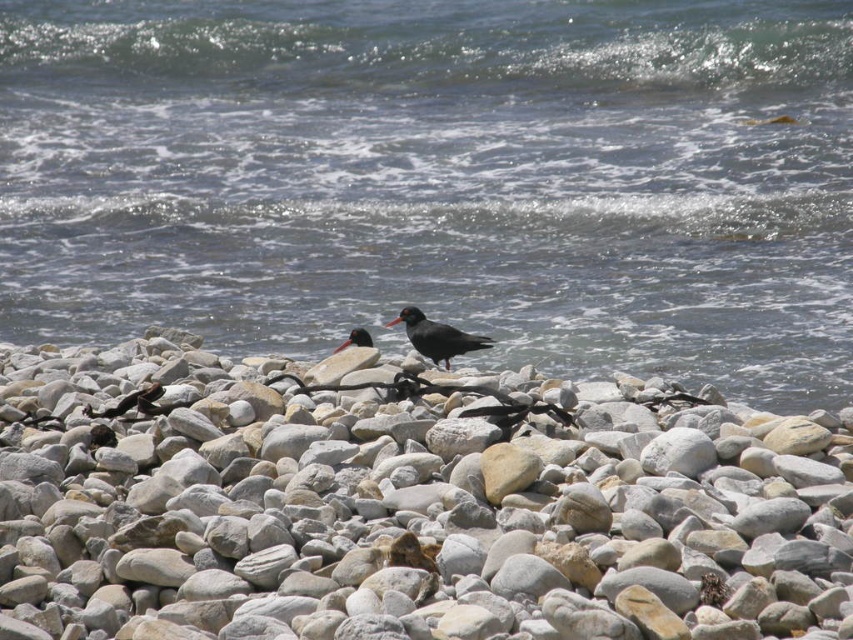
Question: Which object is closer to the camera taking this photo?

Choices:
 (A) black matte bird at lower left
 (B) clear water at center

Answer: (A)

Question: Does clear water at center have a smaller size compared to black matte bird at lower left?

Choices:
 (A) no
 (B) yes

Answer: (A)

Question: Which of the following is the farthest from the observer?

Choices:
 (A) (347, 344)
 (B) (421, 332)
 (C) (444, 444)
 (D) (114, 417)

Answer: (B)

Question: From the image, what is the correct spatial relationship of black matte bird at lower left in relation to smooth black bird at center?

Choices:
 (A) below
 (B) above

Answer: (A)

Question: In this image, where is black matte bird at center located relative to smooth black bird at center?

Choices:
 (A) left
 (B) right

Answer: (B)

Question: Which object is positioned closest to the smooth black bird at center?

Choices:
 (A) black matte bird at center
 (B) clear water at center
 (C) smooth gray rock at center
 (D) black matte bird at lower left

Answer: (A)